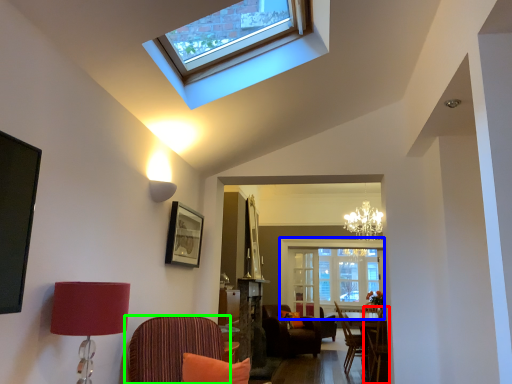
Question: Considering the real-world distances, which object is farthest from chair (highlighted by a red box)? window screen (highlighted by a blue box) or chair (highlighted by a green box)?

Choices:
 (A) window screen
 (B) chair

Answer: (A)